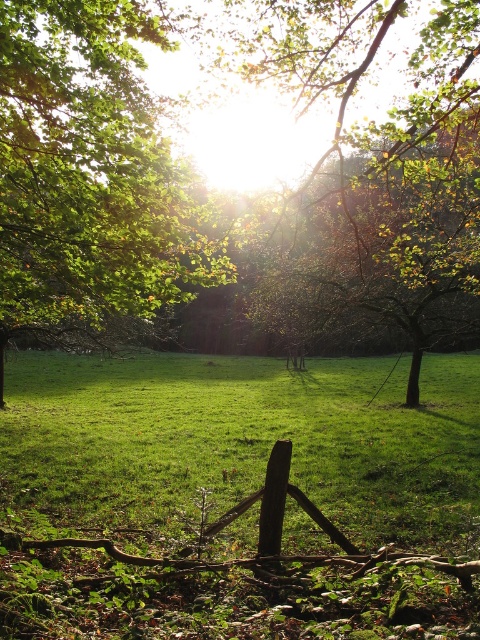
You are standing at the point marked as point (243, 442) in the image. What type of terrain are you currently standing on?

The point (243, 442) is on the green grassy field at center, so you are standing on a grassy terrain.

You are a hiker standing at the brown wood fence at center in the woodland scene. You want to take a photo of the green leafy tree at upper left. Which direction should you face to capture it in your view?

The green leafy tree at upper left is to the left of the brown wood fence at center, so you should face to the left to capture it in your view.

You are a hiker standing at the edge of the meadow. You see the green leafy tree at upper left and the brown wood fence at center. Which object is taller?

The green leafy tree at upper left is taller than the brown wood fence at center.